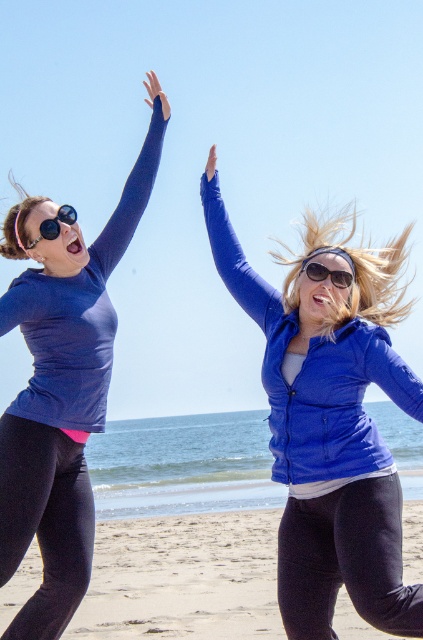
You are standing on the beach and see the blue shiny jacket at center. If you want to reach it in 3 seconds, what is the minimum speed you need to move towards it?

The blue shiny jacket at center is 15.14 feet away. To reach it in 3 seconds, you need to move at a minimum speed of approximately 5.05 feet per second.

You are a photographer trying to capture the scene. You notice the matte blue jacket at upper center and the sunglasses at center. Which object is positioned lower in the image?

The matte blue jacket at upper center is located below the sunglasses at center, so the matte blue jacket at upper center is positioned lower than the sunglasses at center.